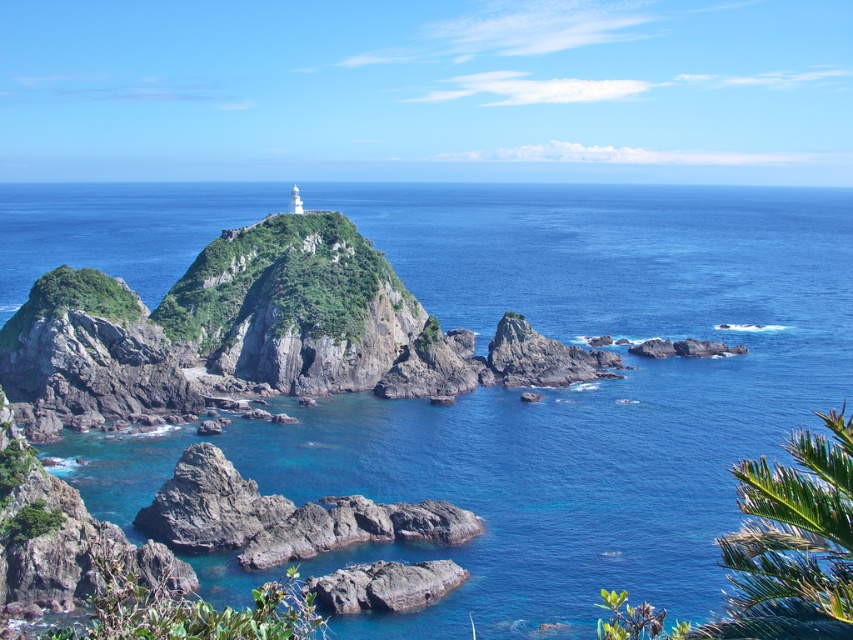
You are a photographer planning to capture the blue clear water at center and the green leafy palm tree at lower right in a single shot. Given that the palm tree is smaller than the water area, which object should you focus on first to ensure both are in frame?

The blue clear water at center is larger in size than the green leafy palm tree at lower right. To ensure both are in frame, focus on the blue clear water at center first since it occupies more space and adjust the camera angle to include the smaller green leafy palm tree at lower right.

You are standing on the shore looking at the coastal scene. You see the blue clear water at center and the rough gray rock at lower center. Which object is positioned to the right of the other?

The blue clear water at center is to the right of the rough gray rock at lower center.

You are standing on the beach and want to take a photo of both the blue clear water at center and the green leafy palm tree at lower right. Which object should you focus on first to ensure both are in the frame?

You should focus on the blue clear water at center first because it is closer to you than the green leafy palm tree at lower right, ensuring both are in the frame.